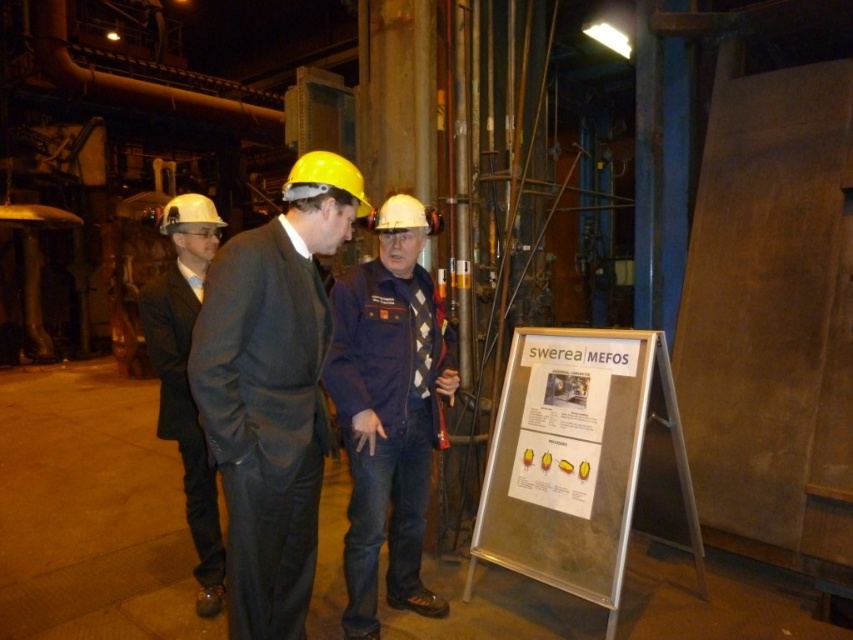
You are an inspector in this industrial facility. You need to report the position of the blue denim jeans at center and the matte black suit at left. Which one is higher in the image?

The blue denim jeans at center is above the matte black suit at left in the image.

Looking at this image, you are an observer in the industrial facility. You notice the matte black suit at center and the white paper at center. Which object is located to the right of the other?

The white paper at center is located to the right of the matte black suit at center.

You are an inspector in this industrial facility. You notice two items at the center of the scene, the blue denim jeans at center and the white paper at center. Which one is taller?

The blue denim jeans at center is taller than the white paper at center.